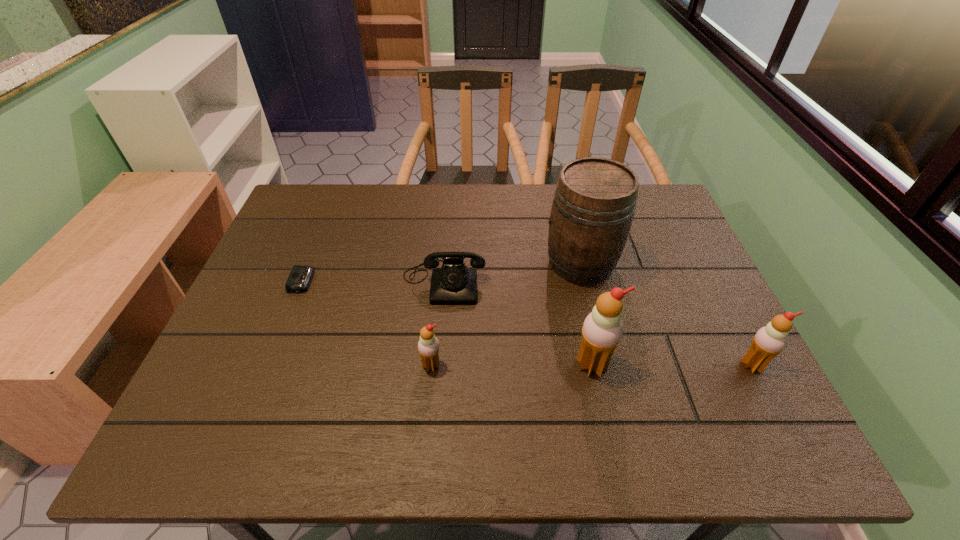
Please point a vacant point for placing a icecream on the left. Please provide its 2D coordinates. Your answer should be formatted as a tuple, i.e. [(x, y)], where the tuple contains the x and y coordinates of a point satisfying the conditions above.

[(271, 366)]